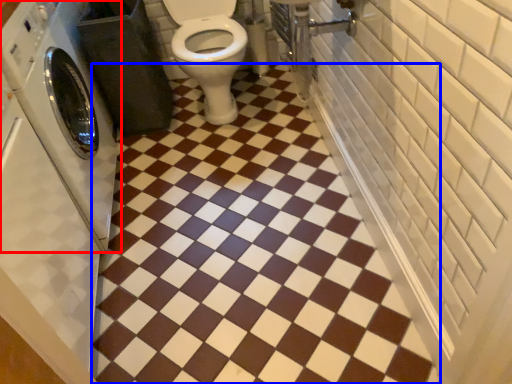
Question: Which of the following is the closest to the observer, washing machine (highlighted by a red box) or ceramic tile (highlighted by a blue box)?

Choices:
 (A) washing machine
 (B) ceramic tile

Answer: (A)